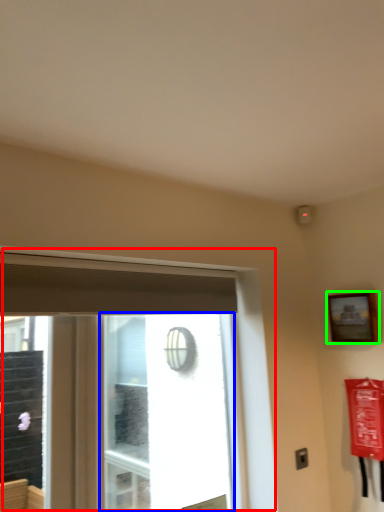
Question: Which object is positioned farthest from window (highlighted by a red box)? Select from window screen (highlighted by a blue box) and picture frame (highlighted by a green box).

Choices:
 (A) window screen
 (B) picture frame

Answer: (A)